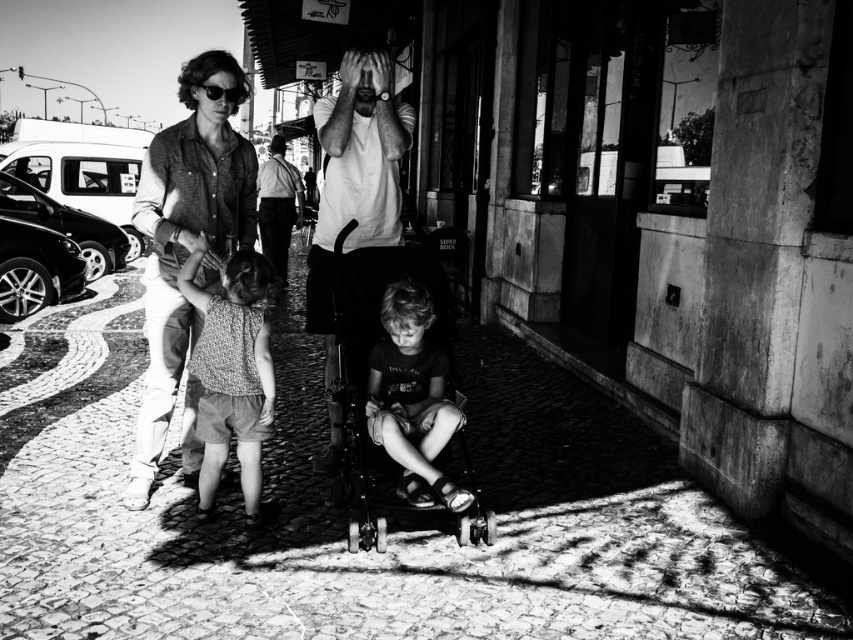
The image size is (853, 640). What do you see at coordinates (277, 205) in the screenshot?
I see `smooth white shirt at center` at bounding box center [277, 205].

Looking at this image, between smooth white shirt at center and shiny black sunglasses at upper left, which one has less height?

shiny black sunglasses at upper left

In the scene shown: Who is more forward, (262, 195) or (225, 99)?

Point (225, 99) is more forward.

Identify the location of smooth white shirt at center. Image resolution: width=853 pixels, height=640 pixels. (277, 205).

Is point (685, 561) positioned before point (230, 97)?

Yes.

Does cobblestone pavement at lower center appear on the right side of shiny black sunglasses at upper left?

Yes, cobblestone pavement at lower center is to the right of shiny black sunglasses at upper left.

Between point (282, 474) and point (225, 99), which one is positioned in front?

Positioned in front is point (225, 99).

Locate an element on the screen. cobblestone pavement at lower center is located at coordinates (344, 518).

In the scene shown: Can you confirm if white matte t-shirt at center is taller than metallic stroller at center?

Yes.

Does white matte t-shirt at center have a lesser width compared to metallic stroller at center?

Incorrect, white matte t-shirt at center's width is not less than metallic stroller at center's.

This screenshot has width=853, height=640. What do you see at coordinates (354, 192) in the screenshot?
I see `white matte t-shirt at center` at bounding box center [354, 192].

Find the location of `white matte t-shirt at center`. white matte t-shirt at center is located at coordinates (354, 192).